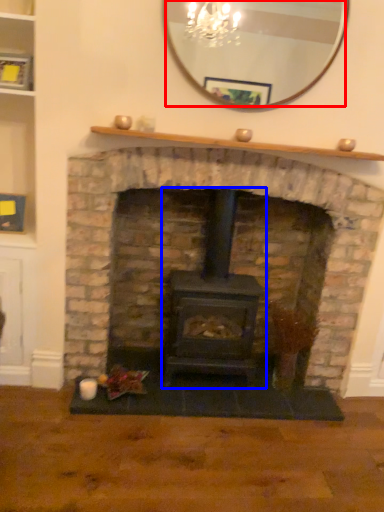
Question: Which object appears closest to the camera in this image, mirror (highlighted by a red box) or wood burning stove (highlighted by a blue box)?

Choices:
 (A) mirror
 (B) wood burning stove

Answer: (A)